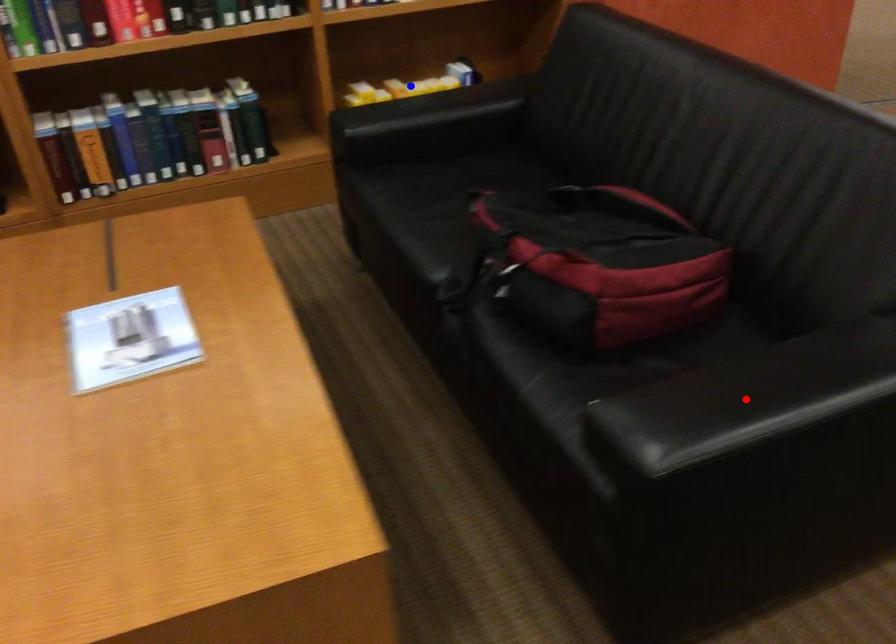
Question: In the image, two points are highlighted. Which point is nearer to the camera? Reply with the corresponding letter.

Choices:
 (A) blue point
 (B) red point

Answer: (B)